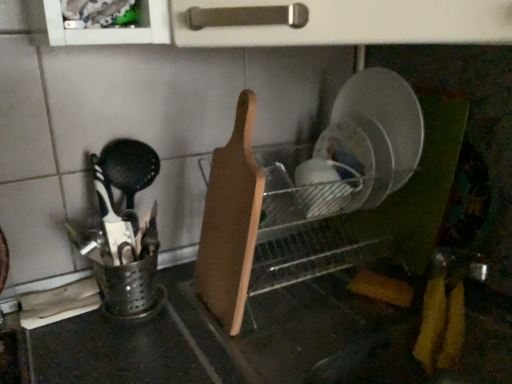
Question: Is wooden cutting board at center bigger than matte white bowl at center?

Choices:
 (A) yes
 (B) no

Answer: (A)

Question: Is there a large distance between wooden cutting board at center and matte white bowl at center?

Choices:
 (A) yes
 (B) no

Answer: (B)

Question: Is wooden cutting board at center positioned in front of matte white bowl at center?

Choices:
 (A) yes
 (B) no

Answer: (A)

Question: Is wooden cutting board at center wider than matte white bowl at center?

Choices:
 (A) no
 (B) yes

Answer: (B)

Question: Can you confirm if wooden cutting board at center is positioned to the left of matte white bowl at center?

Choices:
 (A) yes
 (B) no

Answer: (A)

Question: From a real-world perspective, is wooden cutting board at center positioned over matte white bowl at center based on gravity?

Choices:
 (A) yes
 (B) no

Answer: (A)

Question: From the image's perspective, would you say matte white bowl at center is shown under wooden cutting board at center?

Choices:
 (A) yes
 (B) no

Answer: (B)

Question: Considering the relative sizes of matte white bowl at center and wooden cutting board at center in the image provided, is matte white bowl at center thinner than wooden cutting board at center?

Choices:
 (A) yes
 (B) no

Answer: (A)

Question: Is matte white bowl at center looking in the opposite direction of wooden cutting board at center?

Choices:
 (A) no
 (B) yes

Answer: (A)

Question: From a real-world perspective, is matte white bowl at center positioned under wooden cutting board at center based on gravity?

Choices:
 (A) no
 (B) yes

Answer: (B)

Question: Is matte white bowl at center smaller than wooden cutting board at center?

Choices:
 (A) no
 (B) yes

Answer: (B)

Question: Is matte white bowl at center further to camera compared to wooden cutting board at center?

Choices:
 (A) yes
 (B) no

Answer: (A)

Question: In the image, is wooden cutting board at center positioned in front of or behind matte white bowl at center?

Choices:
 (A) front
 (B) behind

Answer: (A)